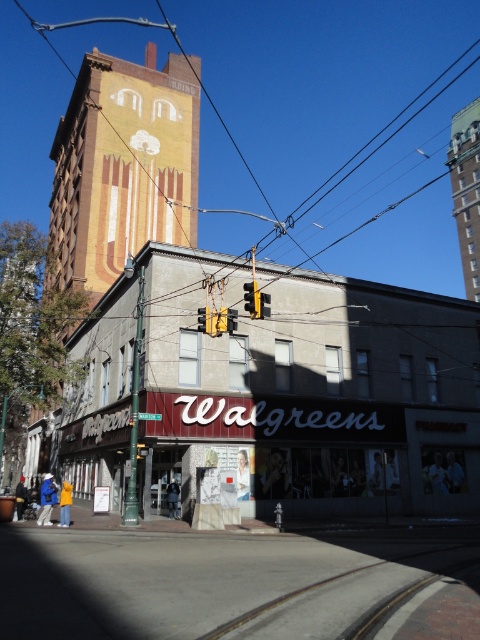
Question: Where is brown brick tower at upper center located in relation to yellow plastic traffic light at upper center in the image?

Choices:
 (A) left
 (B) right

Answer: (B)

Question: Is yellow metal train track at lower center to the left of yellow plastic traffic light at center from the viewer's perspective?

Choices:
 (A) yes
 (B) no

Answer: (B)

Question: Among these points, which one is nearest to the camera?

Choices:
 (A) (389, 557)
 (B) (453, 177)
 (C) (207, 320)
 (D) (252, 317)

Answer: (A)

Question: Which point is closer to the camera?

Choices:
 (A) brown brick tower at upper center
 (B) yellow plastic traffic light at center
 (C) yellow plastic traffic light at upper center
 (D) yellow metal train track at lower center

Answer: (D)

Question: Can you confirm if yellow plastic traffic light at center is thinner than yellow plastic traffic light at upper center?

Choices:
 (A) yes
 (B) no

Answer: (B)

Question: Which point is farther from the camera taking this photo?

Choices:
 (A) (210, 330)
 (B) (256, 291)
 (C) (464, 253)

Answer: (C)